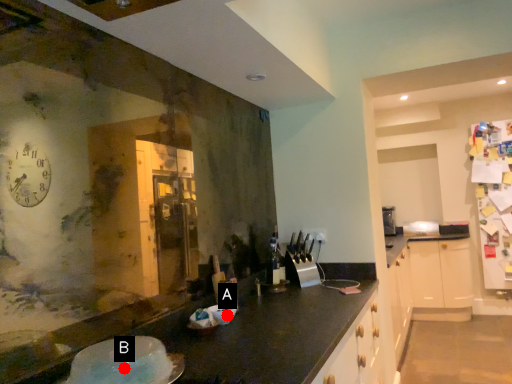
Question: Two points are circled on the image, labeled by A and B beside each circle. Which of the following is the closest to the observer?

Choices:
 (A) A is closer
 (B) B is closer

Answer: (B)